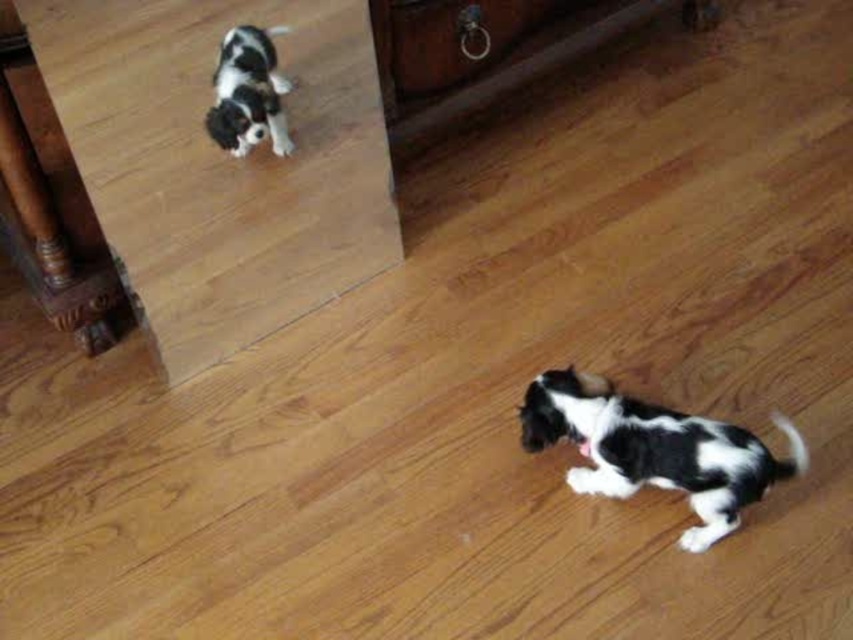
You are a dog owner who wants to place a new toy for your black and white fur dog at upper left. The toy is 10 cm wide. The matte brown drawer at upper center has a 15 cm wide opening. Can the toy fit into the drawer opening?

The matte brown drawer at upper center has a 15 cm wide opening, so the 10 cm wide toy can fit into the drawer opening.

You are a dog trainer observing the scene. You need to place a treat between the black and white fur dog at lower right and the matte brown drawer at upper center. Which object should you place the treat closer to to ensure it is within reach of the dog?

The black and white fur dog at lower right is wider than the matte brown drawer at upper center. To ensure the treat is within reach of the dog, place it closer to the black and white fur dog at lower right.

You are standing at point (267, 124) and want to walk to the mirror. The mirror is at point (598, 428). Is the mirror in front of you or behind you?

The mirror at point (598, 428) is in front of you because it is located in front of point (267, 124) where you are standing.